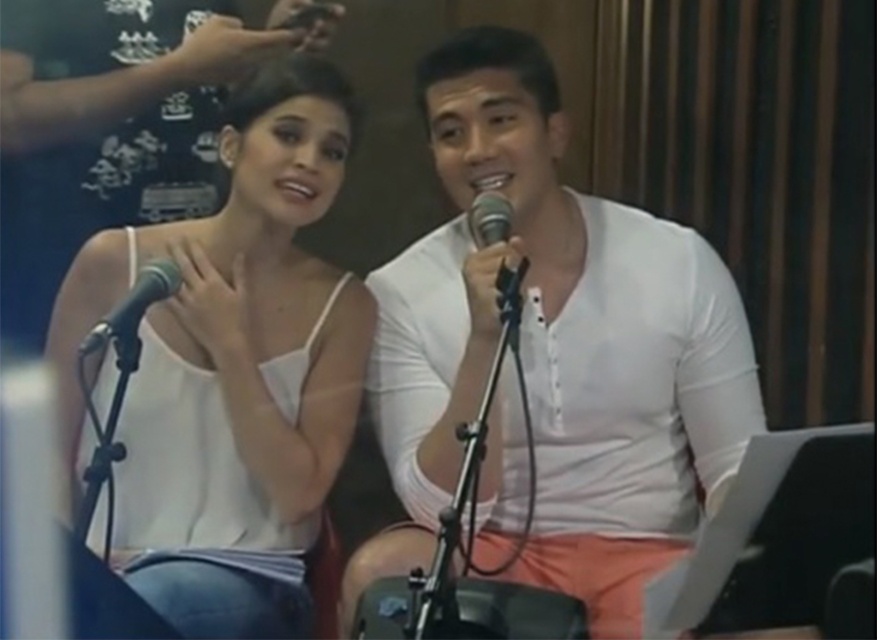
Consider the image. You are a photographer setting up for a portrait session. You need to ensure that the white smooth shirt at center and the black metallic microphone at left are both in frame. Given that the camera has a fixed focal length, which object should you adjust the focus on first to ensure both are in focus, considering their sizes?

The white smooth shirt at center is wider than the black metallic microphone at left. Since the shirt is wider, you should focus on the shirt first to ensure both objects are within the depth of field.